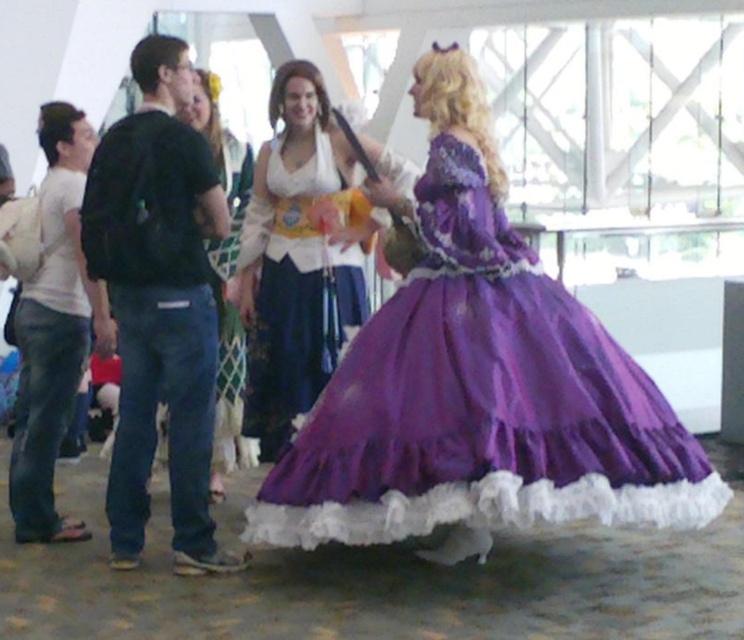
You are a photographer positioned at the center of the scene. You need to capture a photo that includes both the matte white blouse at center and the purple gown with white lace trim at the bottom. Which direction should you move to ensure both are in frame?

The matte white blouse at center is located at point [298,259], so you should move towards the center to include both the matte white blouse at center and the purple gown with white lace trim at the bottom in the frame.

You are organizing a costume party and need to ensure that all guests have the correct size of white attire. You have a matte white blouse at center and a matte white shirt at left. Which one should you choose if you need a larger size?

The matte white shirt at left is larger in size compared to the matte white blouse at center, so you should choose the matte white shirt at left for a larger size.

You are organizing a costume party and need to arrange seating so that the matte white shirt at left and the matte white dress at center can both fit comfortably. Which of the two requires more space for seating?

The matte white dress at center requires more space for seating since it occupies more space than the matte white shirt at left according to the description.